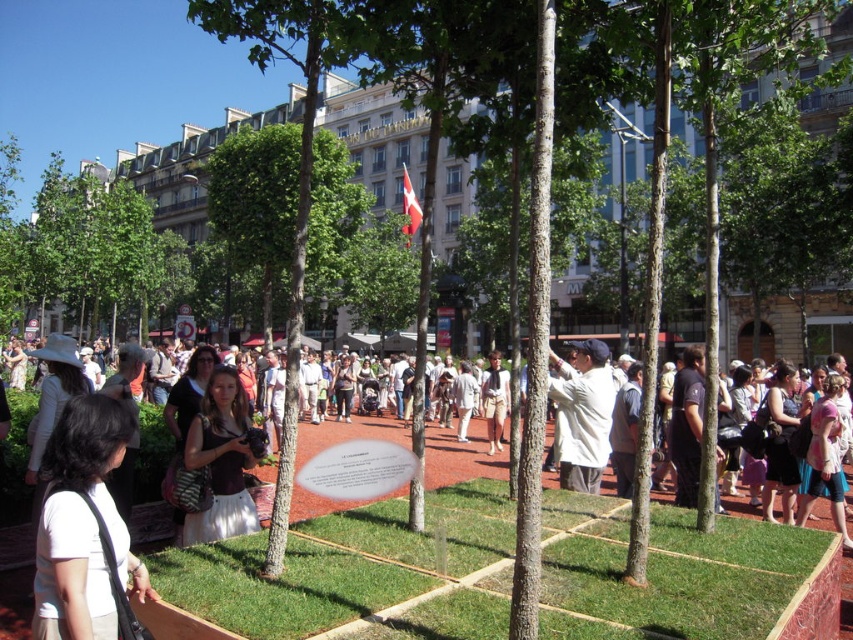
You are organizing a small picnic in the park and have brought both the white fabric bag at lower left and the beige fabric dress at center. Since you need to choose one item to carry your snacks, which item would be more suitable based on their sizes?

The beige fabric dress at center is larger than the white fabric bag at lower left, so it would be more suitable for carrying snacks due to its bigger size.

You are attending an outdoor event and see a white fabric bag at lower left and a beige fabric dress at center. Which item is positioned further to the left?

The white fabric bag at lower left is positioned further to the left than the beige fabric dress at center.

You are standing in the public square and notice two people wearing a white cotton shirt at center and a beige fabric dress at center. Which clothing item reaches higher up on the person?

The white cotton shirt at center has a greater height compared to the beige fabric dress at center, so the white cotton shirt at center reaches higher up on the person.